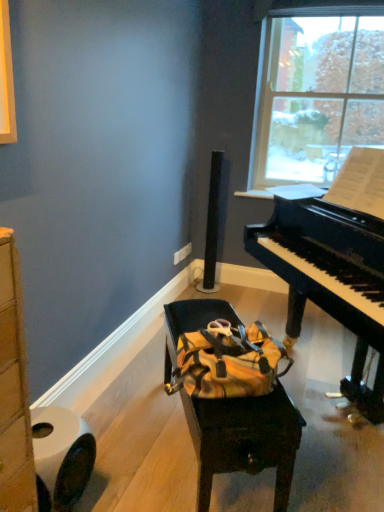
Question: Should I look upward or downward to see transparent glass window at upper right?

Choices:
 (A) down
 (B) up

Answer: (B)

Question: Is yellow fabric bag at center smaller than white matte toilet paper at lower left?

Choices:
 (A) no
 (B) yes

Answer: (A)

Question: From a real-world perspective, is yellow fabric bag at center under white matte toilet paper at lower left?

Choices:
 (A) yes
 (B) no

Answer: (B)

Question: Are yellow fabric bag at center and white matte toilet paper at lower left far apart?

Choices:
 (A) no
 (B) yes

Answer: (A)

Question: Is the depth of yellow fabric bag at center less than that of white matte toilet paper at lower left?

Choices:
 (A) yes
 (B) no

Answer: (B)

Question: Is yellow fabric bag at center wider than white matte toilet paper at lower left?

Choices:
 (A) no
 (B) yes

Answer: (B)

Question: Considering the relative sizes of yellow fabric bag at center and white matte toilet paper at lower left in the image provided, is yellow fabric bag at center taller than white matte toilet paper at lower left?

Choices:
 (A) no
 (B) yes

Answer: (B)

Question: Considering the relative sizes of black polished piano at right and transparent glass window at upper right in the image provided, is black polished piano at right bigger than transparent glass window at upper right?

Choices:
 (A) no
 (B) yes

Answer: (B)

Question: From a real-world perspective, is black polished piano at right positioned over transparent glass window at upper right based on gravity?

Choices:
 (A) no
 (B) yes

Answer: (A)

Question: Would you say black polished piano at right contains transparent glass window at upper right?

Choices:
 (A) yes
 (B) no

Answer: (B)

Question: Is black polished piano at right outside of transparent glass window at upper right?

Choices:
 (A) yes
 (B) no

Answer: (A)

Question: Is black polished piano at right at the right side of transparent glass window at upper right?

Choices:
 (A) no
 (B) yes

Answer: (B)

Question: Is black polished piano at right not close to transparent glass window at upper right?

Choices:
 (A) no
 (B) yes

Answer: (B)

Question: Is white matte toilet paper at lower left taller than yellow fabric bag at center?

Choices:
 (A) no
 (B) yes

Answer: (A)